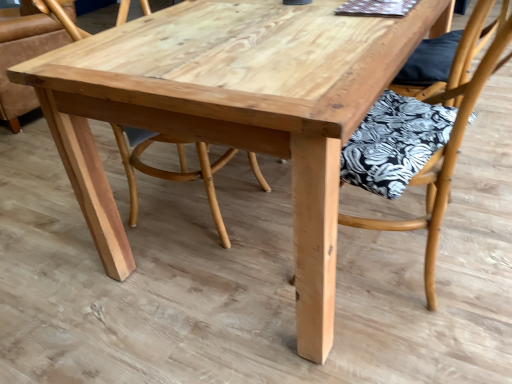
The height and width of the screenshot is (384, 512). What are the coordinates of `vacant space underneath wooden chair with floral cushion at center, which ranks as the 1th chair in right-to-left order (from a real-world perspective)` in the screenshot? It's located at (417, 260).